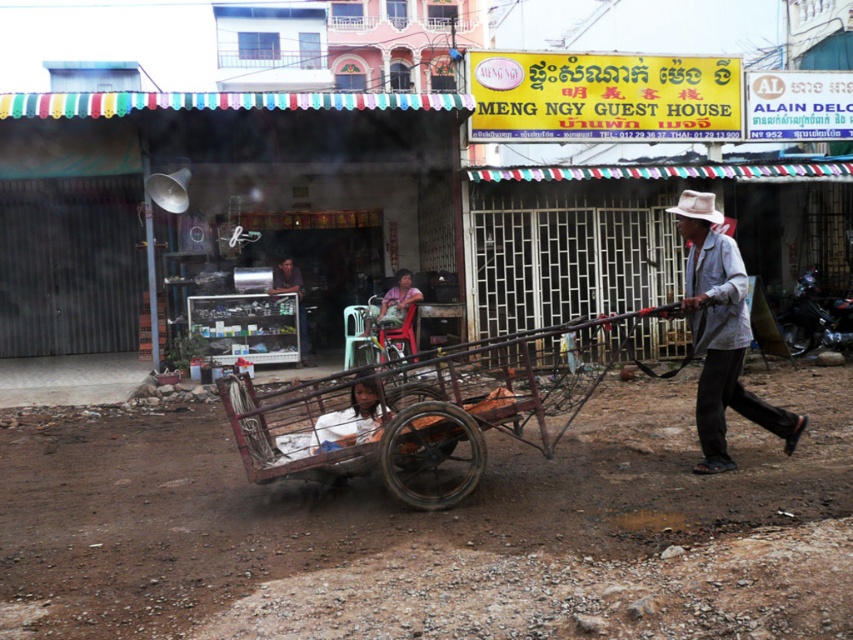
Does light brown fabric hat at right have a greater height compared to dark gray metal cart at center?

Indeed, light brown fabric hat at right has a greater height compared to dark gray metal cart at center.

From the picture: Is light brown fabric hat at right positioned in front of dark gray metal cart at center?

Yes.

This screenshot has height=640, width=853. What are the coordinates of `light brown fabric hat at right` in the screenshot? It's located at (721, 333).

In the scene shown: Between rusty metal cart at center and dark gray metal cart at center, which one appears on the left side from the viewer's perspective?

From the viewer's perspective, dark gray metal cart at center appears more on the left side.

Is point (268, 433) less distant than point (296, 285)?

Yes.

Who is more distant from viewer, (378,371) or (283,288)?

The point (283,288) is behind.

The height and width of the screenshot is (640, 853). What are the coordinates of `rusty metal cart at center` in the screenshot? It's located at (428, 410).

Which is above, rusty metal cart at center or matte brown cart at center?

matte brown cart at center is higher up.

In the scene shown: Which of these two, rusty metal cart at center or matte brown cart at center, stands taller?

matte brown cart at center is taller.

Is point (366, 456) positioned in front of point (392, 317)?

Yes.

In order to click on rusty metal cart at center in this screenshot , I will do pos(428,410).